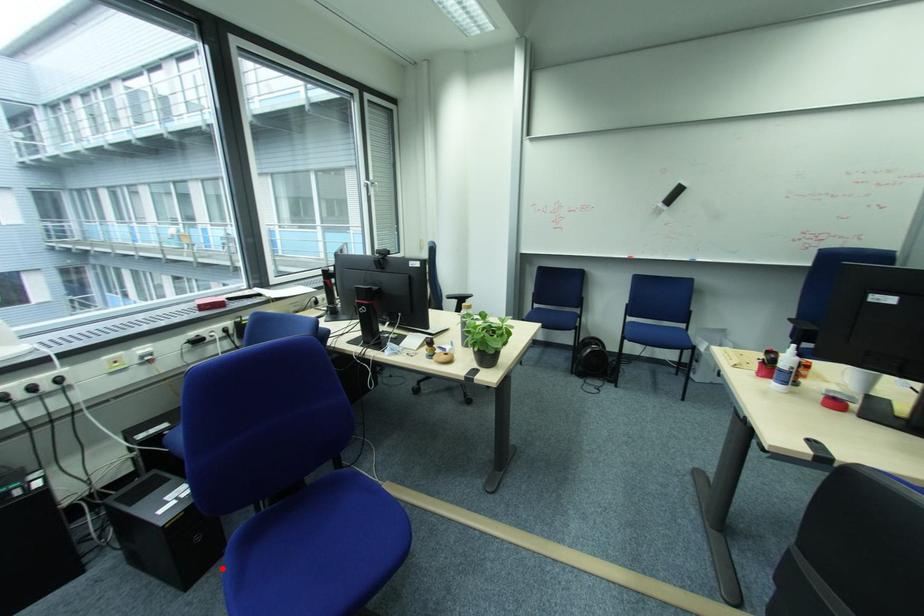
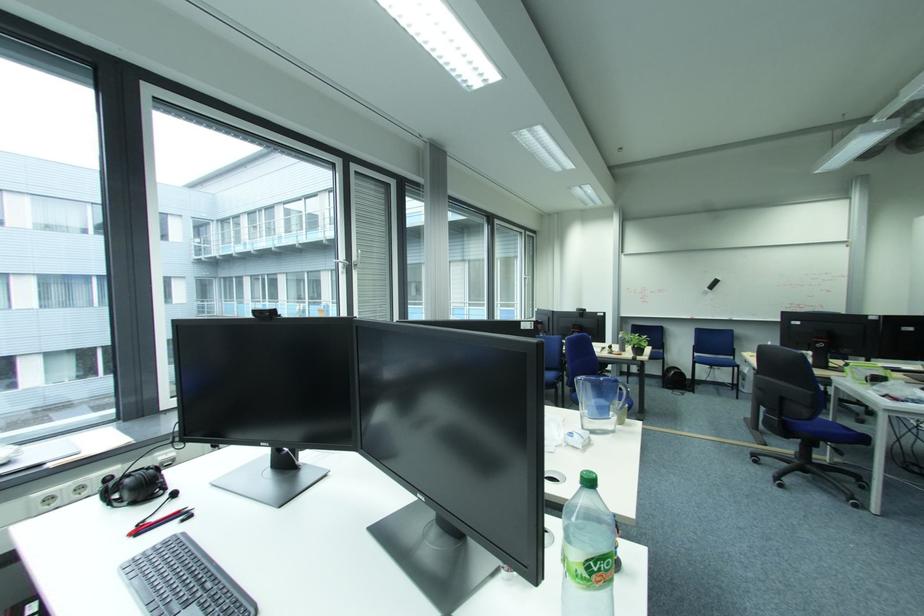
Question: I am providing you with two images of the same scene from different viewpoints. A red point is marked on the first image. At the location where the point appears in image 1, is it still visible in image 2?

Choices:
 (A) Yes
 (B) No

Answer: (B)